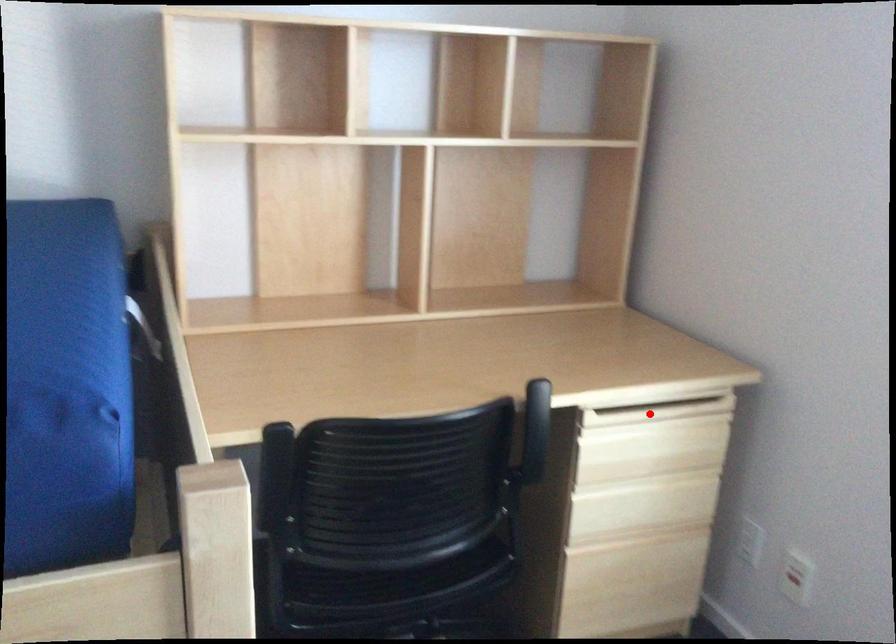
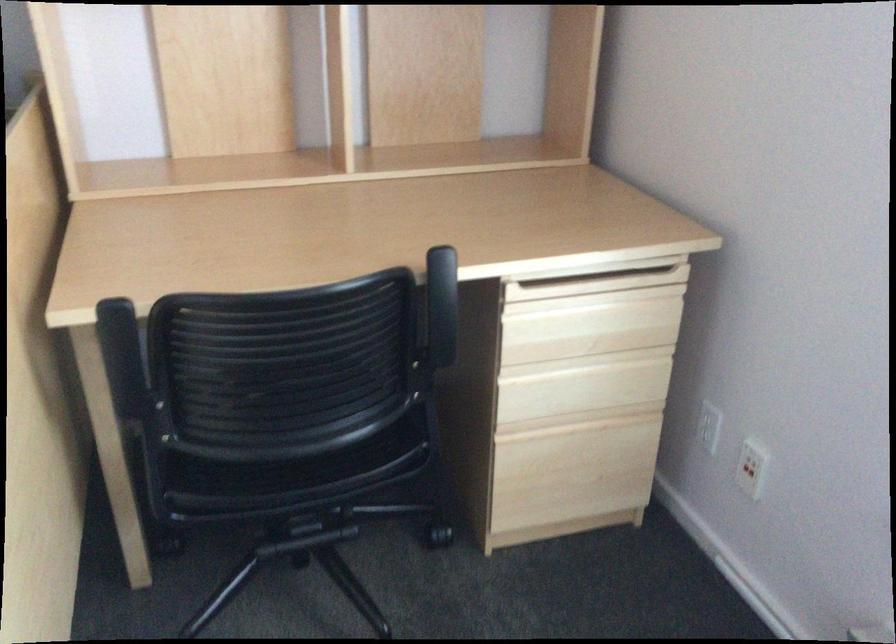
Question: I am providing you with two images of the same scene from different viewpoints. In image1, a red point is highlighted. Considering the same 3D point in image2, which of the following is correct?

Choices:
 (A) It is closer
 (B) It is farther

Answer: (A)